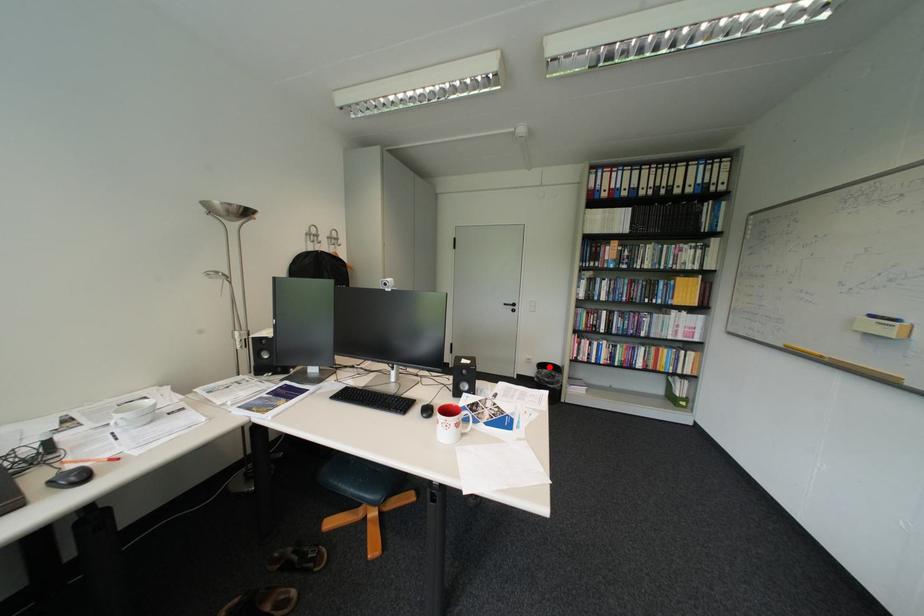
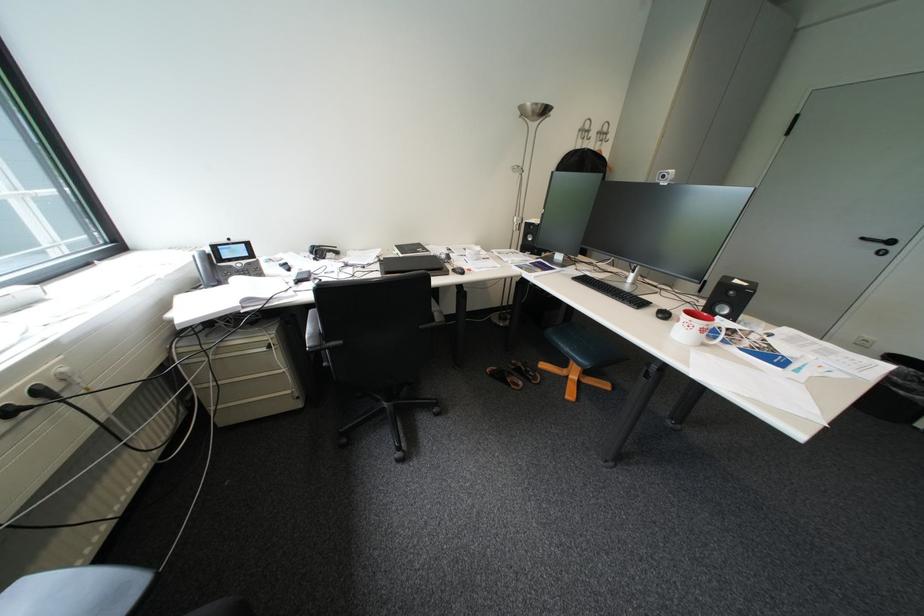
Question: I am providing you with two images of the same scene from different viewpoints. In image1, a red point is highlighted. Considering the same 3D point in image2, which of the following is correct?

Choices:
 (A) It is closer
 (B) It is farther

Answer: (B)